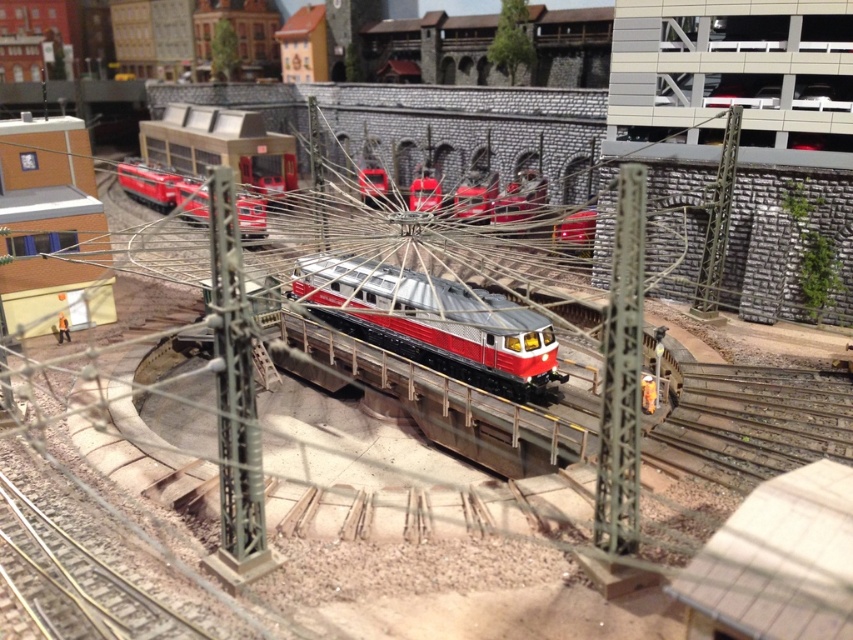
You are a model railway enthusiast examining the scene. You notice two trains, the matte red train at upper left and the red glossy train at center. Which one is larger in size?

The matte red train at upper left is bigger than the red glossy train at center.